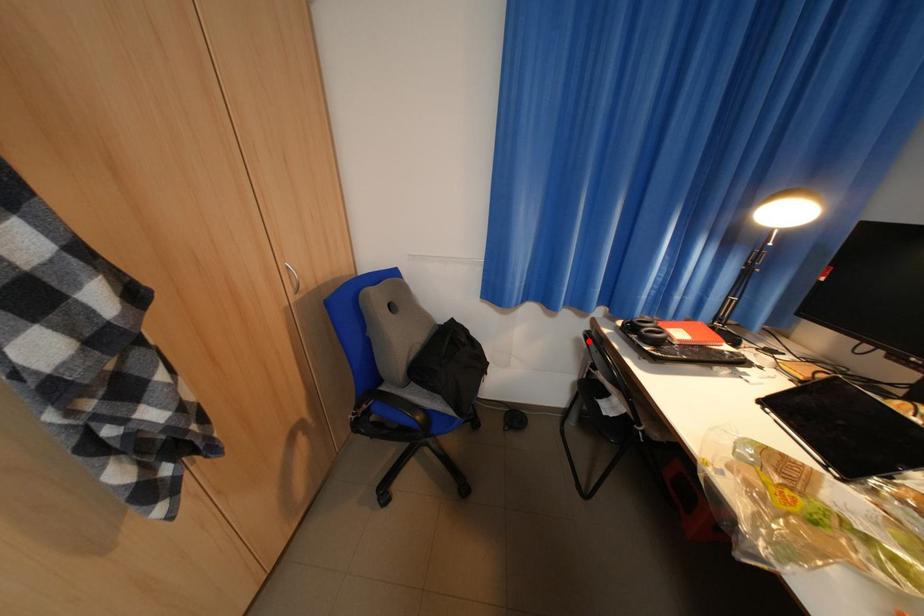
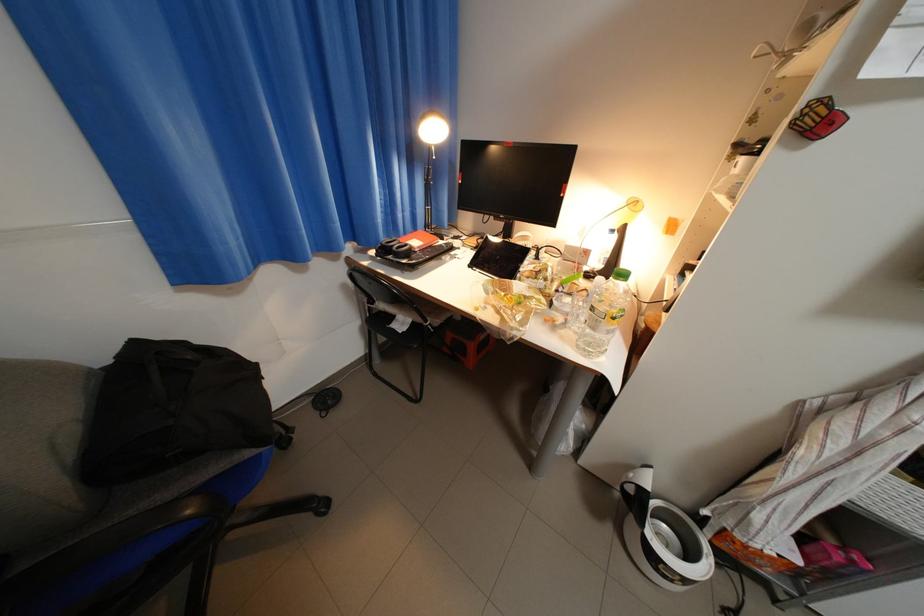
Where in the second image is the point corresponding to the highlighted location from the first image?

(355, 286)